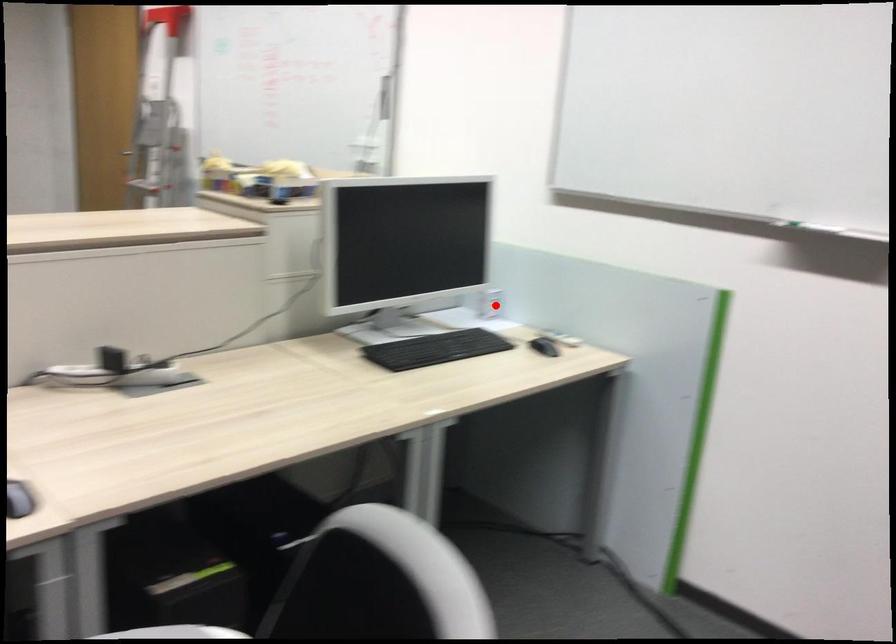
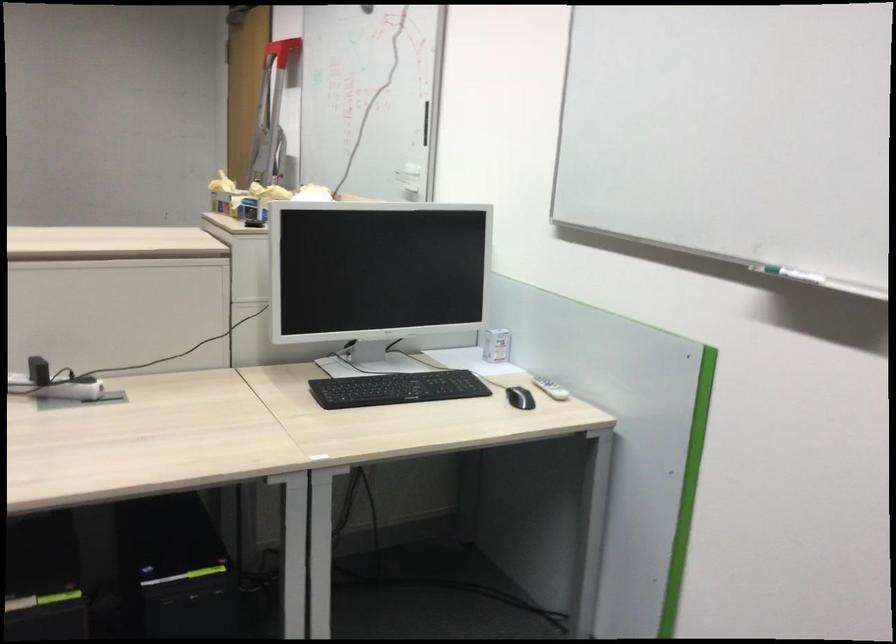
Question: I am providing you with two images of the same scene from different viewpoints. Image1 has a red point marked. In image2, the corresponding 3D location appears at what relative position? Reply with the corresponding letter.

Choices:
 (A) Closer
 (B) Farther

Answer: (A)